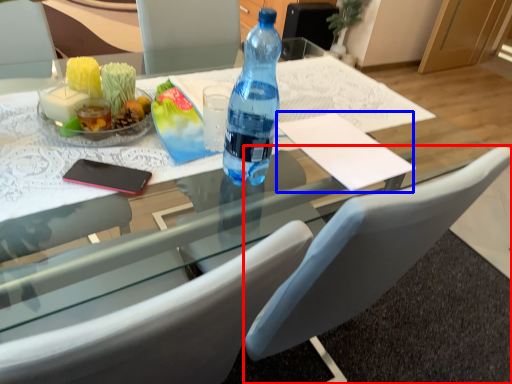
Question: Which object is further to the camera taking this photo, chair (highlighted by a red box) or notepad (highlighted by a blue box)?

Choices:
 (A) chair
 (B) notepad

Answer: (B)